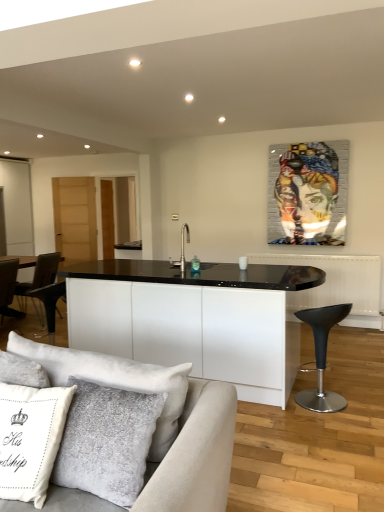
Question: Does transparent glass door at left have a lesser width compared to black leather stool at lower right?

Choices:
 (A) yes
 (B) no

Answer: (B)

Question: Would you say black leather stool at lower right is part of transparent glass door at left's contents?

Choices:
 (A) no
 (B) yes

Answer: (A)

Question: Is transparent glass door at left placed right next to black leather stool at lower right?

Choices:
 (A) no
 (B) yes

Answer: (A)

Question: Is transparent glass door at left positioned beyond the bounds of black leather stool at lower right?

Choices:
 (A) no
 (B) yes

Answer: (B)

Question: From the image's perspective, is transparent glass door at left over black leather stool at lower right?

Choices:
 (A) no
 (B) yes

Answer: (B)

Question: From a real-world perspective, is white textured pillow at lower left positioned above or below black matte sink at center?

Choices:
 (A) below
 (B) above

Answer: (A)

Question: Considering the positions of white textured pillow at lower left and black matte sink at center in the image, is white textured pillow at lower left wider or thinner than black matte sink at center?

Choices:
 (A) thin
 (B) wide

Answer: (B)

Question: Visually, is white textured pillow at lower left positioned to the left or to the right of black matte sink at center?

Choices:
 (A) left
 (B) right

Answer: (A)

Question: Is white textured pillow at lower left situated inside black matte sink at center or outside?

Choices:
 (A) outside
 (B) inside

Answer: (A)

Question: Is beige fabric couch at lower left taller or shorter than transparent glass door at left?

Choices:
 (A) short
 (B) tall

Answer: (A)

Question: From the image's perspective, is beige fabric couch at lower left positioned above or below transparent glass door at left?

Choices:
 (A) above
 (B) below

Answer: (B)

Question: Is point (226, 477) closer or farther from the camera than point (31, 210)?

Choices:
 (A) farther
 (B) closer

Answer: (B)

Question: Is beige fabric couch at lower left in front of or behind transparent glass door at left in the image?

Choices:
 (A) behind
 (B) front

Answer: (B)

Question: Is metallic mosaic portrait at upper center inside or outside of black matte sink at center?

Choices:
 (A) outside
 (B) inside

Answer: (A)

Question: Is metallic mosaic portrait at upper center bigger or smaller than black matte sink at center?

Choices:
 (A) small
 (B) big

Answer: (B)